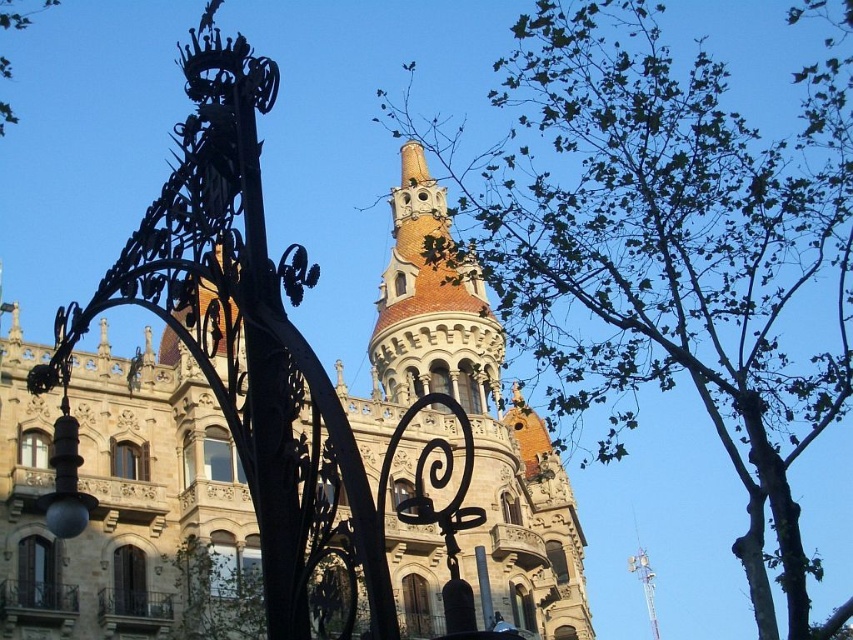
You are a landscape architect planning to install a new pathway between the green leafy tree at upper right and the green leafy tree at upper left. The pathway must be exactly 70 meters long. Based on the scene, will the pathway fit perfectly between the two trees?

The green leafy tree at upper right and green leafy tree at upper left are 70.04 meters apart from each other, so the 70 meter pathway will be slightly shorter than the distance between them, leaving a small gap of 0.04 meters.

You are an architect analyzing the placement of the terracotta ceramic tower at center and the green leafy tree at upper left in the scene. Does the tree provide shade to the tower during midday when the sun is directly overhead?

The terracotta ceramic tower at center is positioned under the green leafy tree at upper left, so yes, the tree does provide shade to the tower during midday when the sun is directly overhead.